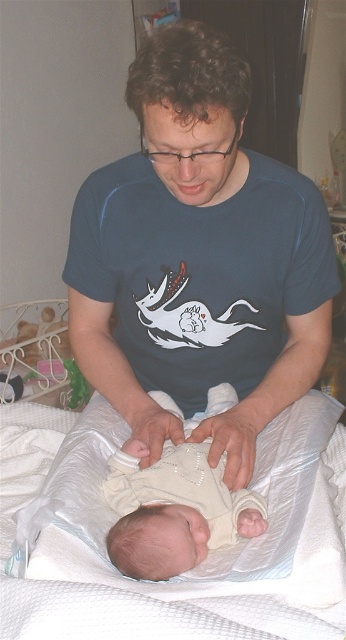
Is white fabric infant bed at center to the left of light beige fabric newborn at center from the viewer's perspective?

Yes, white fabric infant bed at center is to the left of light beige fabric newborn at center.

Does white fabric infant bed at center lie in front of light beige fabric newborn at center?

That is True.

Who is more forward, (22, 470) or (126, 442)?

Point (126, 442) is in front.

You are a GUI agent. You are given a task and a screenshot of the screen. Output one action in this format:
    pyautogui.click(x=<x>, y=<y>)
    Task: Click on the white fabric infant bed at center
    The image size is (346, 640).
    Given the screenshot: What is the action you would take?
    pyautogui.click(x=117, y=588)

Can you confirm if blue cotton shirt at center is positioned to the left of light beige fabric newborn at center?

Yes, blue cotton shirt at center is to the left of light beige fabric newborn at center.

Between blue cotton shirt at center and light beige fabric newborn at center, which one has more height?

blue cotton shirt at center is taller.

Does point (169, 211) come behind point (220, 516)?

Yes.

The width and height of the screenshot is (346, 640). What are the coordinates of `blue cotton shirt at center` in the screenshot? It's located at (197, 259).

This screenshot has width=346, height=640. Find the location of `blue cotton shirt at center`. blue cotton shirt at center is located at coordinates click(x=197, y=259).

Can you confirm if blue cotton shirt at center is taller than white fabric infant bed at center?

Yes, blue cotton shirt at center is taller than white fabric infant bed at center.

This screenshot has height=640, width=346. What are the coordinates of `blue cotton shirt at center` in the screenshot? It's located at (197, 259).